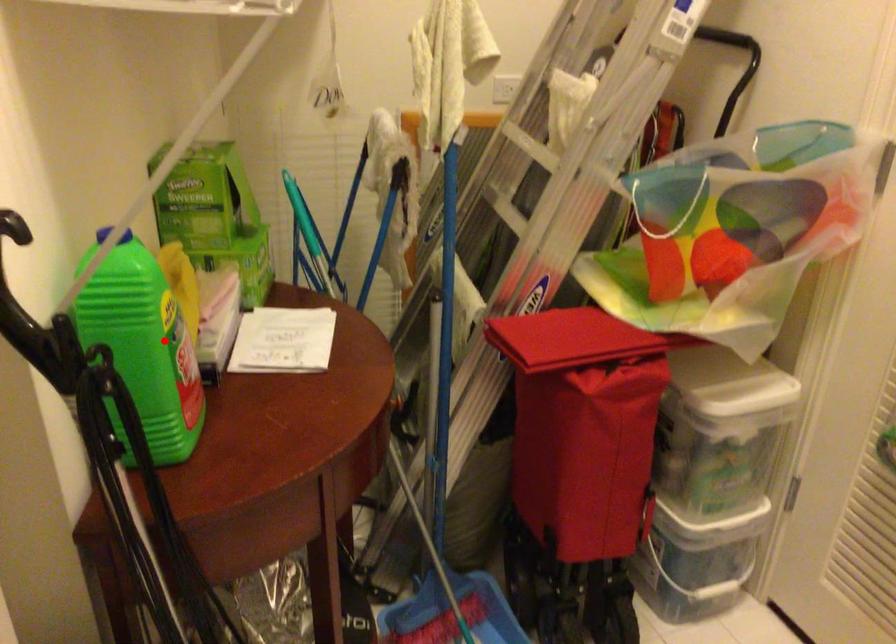
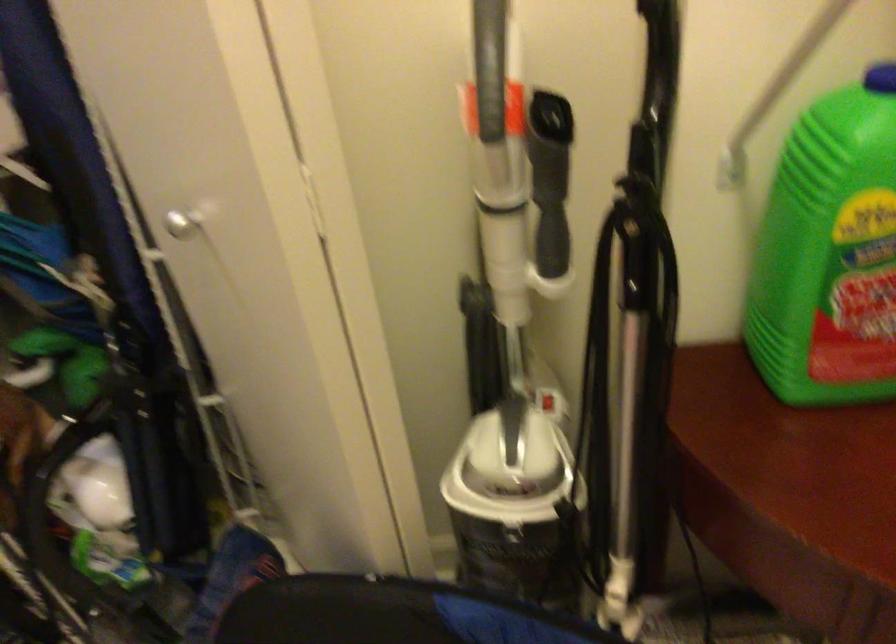
Where in the second image is the point corresponding to the highlighted location from the first image?

(830, 252)